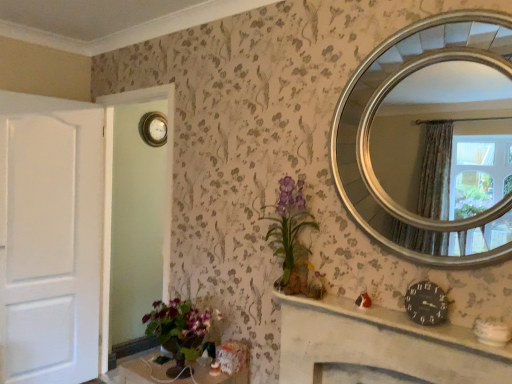
Question: Is black matte clock at lower right, arranged as the second clock when viewed from the back, wider than metallic round clock at upper center, the 2th clock viewed from the front?

Choices:
 (A) yes
 (B) no

Answer: (A)

Question: Does black matte clock at lower right, arranged as the second clock when viewed from the back, have a greater height compared to metallic round clock at upper center, placed as the first clock when sorted from top to bottom?

Choices:
 (A) yes
 (B) no

Answer: (B)

Question: Is black matte clock at lower right, which is the second clock from left to right, positioned before metallic round clock at upper center, which is counted as the 2th clock, starting from the right?

Choices:
 (A) yes
 (B) no

Answer: (A)

Question: From the image's perspective, is black matte clock at lower right, which is the second clock from left to right, on metallic round clock at upper center, which is counted as the 2th clock, starting from the right?

Choices:
 (A) no
 (B) yes

Answer: (A)

Question: Can you confirm if black matte clock at lower right, arranged as the second clock when viewed from the back, is thinner than metallic round clock at upper center, placed as the first clock when sorted from top to bottom?

Choices:
 (A) yes
 (B) no

Answer: (B)

Question: Is black matte clock at lower right, arranged as the second clock when viewed from the back, touching metallic round clock at upper center, which is counted as the 2th clock, starting from the right?

Choices:
 (A) no
 (B) yes

Answer: (A)

Question: From the image's perspective, is gold metallic clock at upper left above metallic round clock at upper center, the 2th clock viewed from the front?

Choices:
 (A) no
 (B) yes

Answer: (A)

Question: Considering the relative sizes of gold metallic clock at upper left and metallic round clock at upper center, placed as the first clock when sorted from back to front, in the image provided, is gold metallic clock at upper left taller than metallic round clock at upper center, placed as the first clock when sorted from back to front,?

Choices:
 (A) no
 (B) yes

Answer: (B)

Question: Is gold metallic clock at upper left closer to camera compared to metallic round clock at upper center, placed as the first clock when sorted from back to front?

Choices:
 (A) yes
 (B) no

Answer: (A)

Question: Can you confirm if gold metallic clock at upper left is positioned to the right of metallic round clock at upper center, placed as the first clock when sorted from top to bottom?

Choices:
 (A) no
 (B) yes

Answer: (A)

Question: Is gold metallic clock at upper left at the left side of metallic round clock at upper center, placed as the first clock when sorted from back to front?

Choices:
 (A) no
 (B) yes

Answer: (B)

Question: Is metallic round clock at upper center, the 2th clock viewed from the front, surrounded by gold metallic clock at upper left?

Choices:
 (A) no
 (B) yes

Answer: (A)

Question: Does black clock at center contain gold metallic clock at upper left?

Choices:
 (A) no
 (B) yes

Answer: (A)